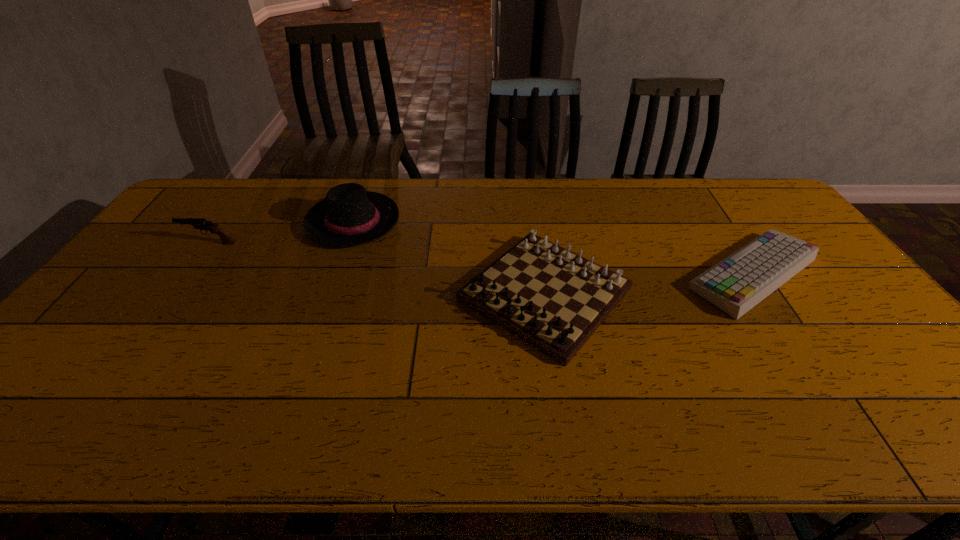
Where is `empty space between the shortest object and the third object from left to right`? This screenshot has height=540, width=960. empty space between the shortest object and the third object from left to right is located at coordinates (649, 284).

The height and width of the screenshot is (540, 960). Identify the location of free space between the gun and the rightmost object. (481, 259).

Locate an element on the screen. free spot between the chessboard and the second object from left to right is located at coordinates (449, 258).

Find the location of a particular element. empty space that is in between the gun and the third tallest object is located at coordinates (377, 268).

At what (x,y) coordinates should I click in order to perform the action: click on empty space that is in between the third object from right to left and the second shortest object. Please return your answer as a coordinate pair (x, y). Image resolution: width=960 pixels, height=540 pixels. Looking at the image, I should click on (449, 258).

Where is `object that ranks as the closest to the gun`? object that ranks as the closest to the gun is located at coordinates (349, 216).

The image size is (960, 540). In order to click on object identified as the closest to the leftmost object in this screenshot , I will do `click(349, 216)`.

Where is `free spot that satisfies the following two spatial constraints: 1. along the barrel of the gun; 2. on the left side of the dress hat`? The height and width of the screenshot is (540, 960). free spot that satisfies the following two spatial constraints: 1. along the barrel of the gun; 2. on the left side of the dress hat is located at coordinates (226, 222).

Identify the location of blank area in the image that satisfies the following two spatial constraints: 1. along the barrel of the leftmost object; 2. on the left side of the third object from right to left. (226, 222).